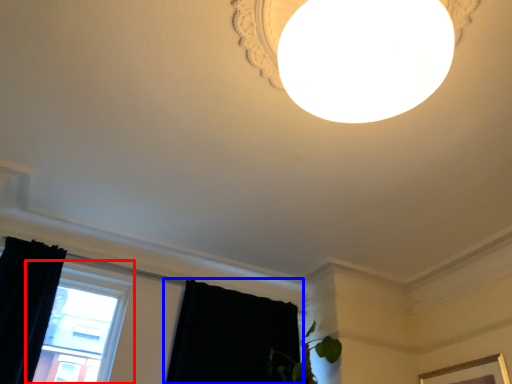
Question: Among these objects, which one is farthest to the camera, window (highlighted by a red box) or curtain (highlighted by a blue box)?

Choices:
 (A) window
 (B) curtain

Answer: (B)